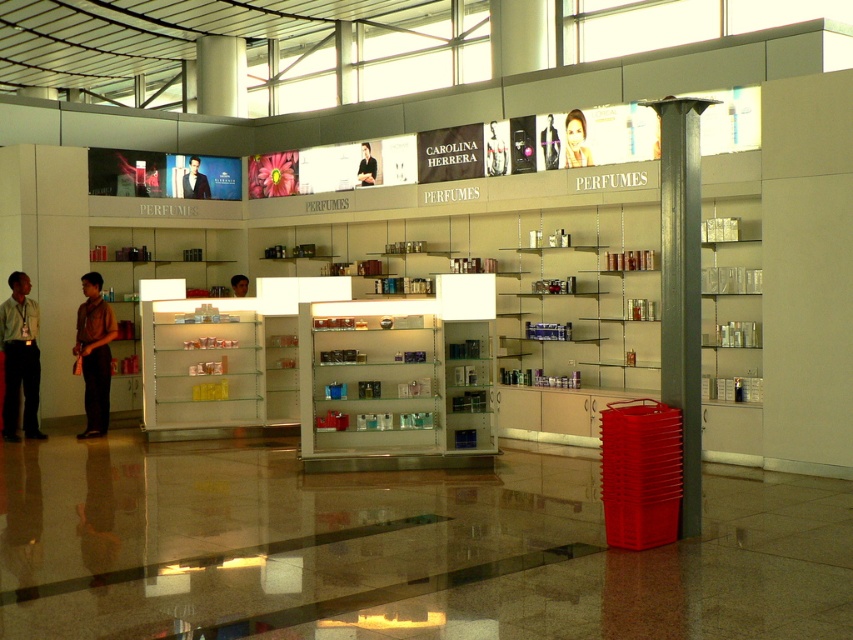
Question: Which of the following is the farthest from the observer?

Choices:
 (A) (549, 125)
 (B) (369, 182)
 (C) (486, 131)
 (D) (589, 161)

Answer: (B)

Question: Can you confirm if matte black shirt at left is wider than smooth skin face at upper center?

Choices:
 (A) no
 (B) yes

Answer: (B)

Question: Which object is farther from the camera taking this photo?

Choices:
 (A) matte black mannequin at center
 (B) metallic gray pole at center
 (C) brown leather jacket at center

Answer: (C)

Question: Which of the following is the closest to the observer?

Choices:
 (A) smooth black suit at center
 (B) brown leather jacket at center
 (C) matte black jacket at upper center

Answer: (C)

Question: Can you confirm if smooth skin face at upper center is bigger than smooth black suit at center?

Choices:
 (A) no
 (B) yes

Answer: (A)

Question: Is matte black shirt at left closer to camera compared to matte black jacket at upper center?

Choices:
 (A) no
 (B) yes

Answer: (A)